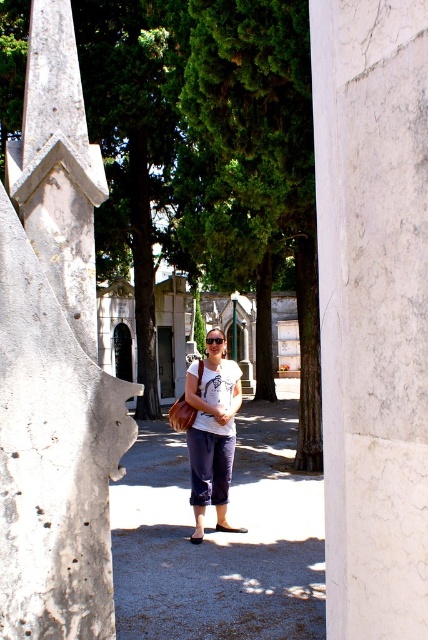
What is the exact coordinate of the denim pants at center?

The denim pants at center is located at point (x=219, y=540).